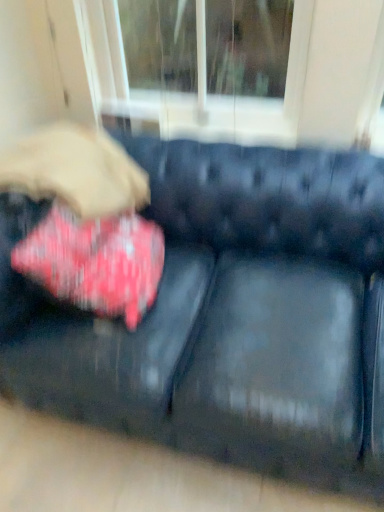
The width and height of the screenshot is (384, 512). What do you see at coordinates (215, 304) in the screenshot? I see `black leather couch at center` at bounding box center [215, 304].

What is the approximate height of black leather couch at center?

The height of black leather couch at center is 29.63 inches.

The image size is (384, 512). Find the location of `black leather couch at center`. black leather couch at center is located at coordinates (215, 304).

The height and width of the screenshot is (512, 384). Describe the element at coordinates (95, 262) in the screenshot. I see `red velvet cushion at left` at that location.

This screenshot has height=512, width=384. I want to click on red velvet cushion at left, so click(x=95, y=262).

What is the approximate width of red velvet cushion at left?

red velvet cushion at left is 13.63 inches in width.

The width and height of the screenshot is (384, 512). What are the coordinates of `black leather couch at center` in the screenshot? It's located at (215, 304).

Which object is positioned more to the left, black leather couch at center or red velvet cushion at left?

Answer: Positioned to the left is red velvet cushion at left.

Consider the image. Is the depth of black leather couch at center greater than that of red velvet cushion at left?

No, the depth of black leather couch at center is less than that of red velvet cushion at left.

Is point (94, 396) positioned in front of point (80, 232)?

Yes, point (94, 396) is closer to viewer.

From the image's perspective, between black leather couch at center and red velvet cushion at left, who is located below?

black leather couch at center appears lower in the image.

From a real-world perspective, is black leather couch at center physically located above or below red velvet cushion at left?

In terms of real-world spatial position, black leather couch at center is below red velvet cushion at left.

Looking at their sizes, would you say black leather couch at center is wider or thinner than red velvet cushion at left?

black leather couch at center is wider than red velvet cushion at left.

Which of these two, black leather couch at center or red velvet cushion at left, stands shorter?

red velvet cushion at left is shorter.

Is black leather couch at center smaller than red velvet cushion at left?

→ No.

Is red velvet cushion at left located within black leather couch at center?

Yes, red velvet cushion at left is inside black leather couch at center.

Are black leather couch at center and red velvet cushion at left beside each other?

No, black leather couch at center is not in contact with red velvet cushion at left.

Is black leather couch at center oriented towards red velvet cushion at left?

Yes, black leather couch at center faces towards red velvet cushion at left.

How many degrees apart are the facing directions of black leather couch at center and red velvet cushion at left?

There is a 96.4-degree angle between the facing directions of black leather couch at center and red velvet cushion at left.

Identify the location of throw pillow lying above the black leather couch at center (from the image's perspective). (95, 262).

Is red velvet cushion at left at the left side of black leather couch at center?

Yes, red velvet cushion at left is to the left of black leather couch at center.

Is red velvet cushion at left positioned behind black leather couch at center?

Yes, it is.

Is point (59, 251) closer to viewer compared to point (304, 167)?

Yes, point (59, 251) is closer to viewer.

From the image's perspective, between red velvet cushion at left and black leather couch at center, which one is located above?

red velvet cushion at left appears higher in the image.

From a real-world perspective, between red velvet cushion at left and black leather couch at center, who is vertically lower?

black leather couch at center, from a real-world perspective.

Considering the sizes of red velvet cushion at left and black leather couch at center in the image, is red velvet cushion at left wider or thinner than black leather couch at center?

Clearly, red velvet cushion at left has less width compared to black leather couch at center.

Between red velvet cushion at left and black leather couch at center, which one has less height?

With less height is red velvet cushion at left.

Considering the relative sizes of red velvet cushion at left and black leather couch at center in the image provided, is red velvet cushion at left smaller than black leather couch at center?

Yes, red velvet cushion at left is smaller than black leather couch at center.

Is red velvet cushion at left outside of black leather couch at center?

→ No, red velvet cushion at left is not entirely external to black leather couch at center.

Are red velvet cushion at left and black leather couch at center located far from each other?

Actually, red velvet cushion at left and black leather couch at center are a little close together.

Could you tell me if red velvet cushion at left is facing black leather couch at center?

Yes.

You are a GUI agent. You are given a task and a screenshot of the screen. Output one action in this format:
    pyautogui.click(x=<x>, y=<y>)
    Task: Click on the studio couch in front of the red velvet cushion at left
    This screenshot has height=512, width=384.
    Given the screenshot: What is the action you would take?
    pyautogui.click(x=215, y=304)

Locate an element on the screen. throw pillow above the black leather couch at center (from the image's perspective) is located at coordinates (95, 262).

Locate an element on the screen. The width and height of the screenshot is (384, 512). studio couch that is on the right side of red velvet cushion at left is located at coordinates (215, 304).